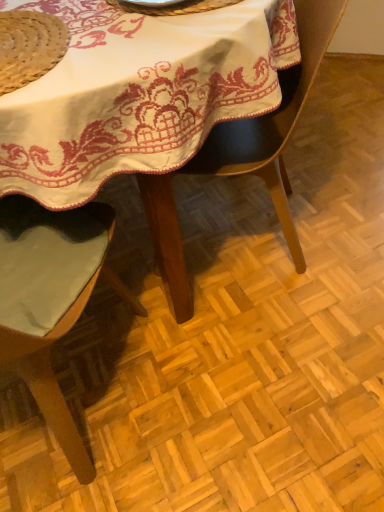
What is the approximate height of metallic silver plate at upper center?

2.01 centimeters.

Measure the distance between black leather chair at center, the first chair viewed from the right, and camera.

The distance of black leather chair at center, the first chair viewed from the right, from camera is 80.70 centimeters.

The width and height of the screenshot is (384, 512). I want to click on natural straw hat at upper left, so click(x=29, y=47).

From the image's perspective, is green fabric chair at left, which appears as the 1th chair when viewed from the left, above or below black leather chair at center, the first chair viewed from the right?

green fabric chair at left, which appears as the 1th chair when viewed from the left, is situated lower than black leather chair at center, the first chair viewed from the right, in the image.

Considering the points (11, 360) and (316, 56), which point is in front, point (11, 360) or point (316, 56)?

The point (11, 360) is more forward.

From a real-world perspective, is green fabric chair at left, which appears as the 1th chair when viewed from the left, positioned over black leather chair at center, the second chair in the left-to-right sequence, based on gravity?

No, from a real-world perspective, green fabric chair at left, which appears as the 1th chair when viewed from the left, is not on top of black leather chair at center, the second chair in the left-to-right sequence.

Which object is wider, natural straw hat at upper left or metallic silver plate at upper center?

metallic silver plate at upper center.

Considering the positions of points (15, 76) and (124, 6), is point (15, 76) closer to camera compared to point (124, 6)?

Yes, point (15, 76) is in front of point (124, 6).

Between natural straw hat at upper left and metallic silver plate at upper center, which one has smaller size?

natural straw hat at upper left is smaller.

Looking at this image, considering the positions of objects natural straw hat at upper left and metallic silver plate at upper center in the image provided, who is more to the left, natural straw hat at upper left or metallic silver plate at upper center?

natural straw hat at upper left.

Considering the points (229, 5) and (53, 51), which point is behind, point (229, 5) or point (53, 51)?

The point (229, 5) is more distant.

Is metallic silver plate at upper center touching natural straw hat at upper left?

They are not placed beside each other.

In the image, is metallic silver plate at upper center on the left side or the right side of natural straw hat at upper left?

metallic silver plate at upper center is positioned on natural straw hat at upper left's right side.

Considering the sizes of objects metallic silver plate at upper center and natural straw hat at upper left in the image provided, who is smaller, metallic silver plate at upper center or natural straw hat at upper left?

natural straw hat at upper left is smaller.

Considering the relative sizes of black leather chair at center, the second chair in the left-to-right sequence, and natural straw hat at upper left in the image provided, is black leather chair at center, the second chair in the left-to-right sequence, smaller than natural straw hat at upper left?

Actually, black leather chair at center, the second chair in the left-to-right sequence, might be larger than natural straw hat at upper left.

From a real-world perspective, is black leather chair at center, the second chair in the left-to-right sequence, positioned under natural straw hat at upper left based on gravity?

Yes.

Measure the distance from black leather chair at center, the second chair in the left-to-right sequence, to natural straw hat at upper left.

A distance of 19.45 inches exists between black leather chair at center, the second chair in the left-to-right sequence, and natural straw hat at upper left.

Is green fabric chair at left, which is the second chair in right-to-left order, inside the boundaries of metallic silver plate at upper center, or outside?

green fabric chair at left, which is the second chair in right-to-left order, is located beyond the bounds of metallic silver plate at upper center.

In the image, is green fabric chair at left, which appears as the 1th chair when viewed from the left, on the left side or the right side of metallic silver plate at upper center?

green fabric chair at left, which appears as the 1th chair when viewed from the left, is positioned on metallic silver plate at upper center's left side.

Based on the photo, looking at the image, does green fabric chair at left, which appears as the 1th chair when viewed from the left, seem bigger or smaller compared to metallic silver plate at upper center?

Considering their sizes, green fabric chair at left, which appears as the 1th chair when viewed from the left, takes up more space than metallic silver plate at upper center.

In the image, there is a green fabric chair at left, which is the second chair in right-to-left order. Where is `tableware above it (from the image's perspective)`? The height and width of the screenshot is (512, 384). tableware above it (from the image's perspective) is located at coordinates (173, 7).

Is natural straw hat at upper left at the left side of white embroidered tablecloth at center?

Indeed, natural straw hat at upper left is positioned on the left side of white embroidered tablecloth at center.

Could you tell me if natural straw hat at upper left is facing white embroidered tablecloth at center?

Yes, natural straw hat at upper left is facing white embroidered tablecloth at center.

Is point (56, 29) farther from viewer compared to point (170, 59)?

Yes, it is behind point (170, 59).

Between natural straw hat at upper left and white embroidered tablecloth at center, which one has larger width?

Wider between the two is white embroidered tablecloth at center.

Considering the relative sizes of natural straw hat at upper left and green fabric chair at left, which appears as the 1th chair when viewed from the left, in the image provided, is natural straw hat at upper left bigger than green fabric chair at left, which appears as the 1th chair when viewed from the left,?

No, natural straw hat at upper left is not bigger than green fabric chair at left, which appears as the 1th chair when viewed from the left.

Are natural straw hat at upper left and green fabric chair at left, which is the second chair in right-to-left order, located far from each other?

No, natural straw hat at upper left is in close proximity to green fabric chair at left, which is the second chair in right-to-left order.

Does natural straw hat at upper left have a greater height compared to green fabric chair at left, which appears as the 1th chair when viewed from the left?

No, natural straw hat at upper left is not taller than green fabric chair at left, which appears as the 1th chair when viewed from the left.

Does point (4, 35) appear closer or farther from the camera than point (58, 246)?

Point (4, 35).

I want to click on chair behind the green fabric chair at left, which appears as the 1th chair when viewed from the left, so click(x=274, y=121).

The width and height of the screenshot is (384, 512). In order to click on straw hat that is in front of the metallic silver plate at upper center in this screenshot , I will do `click(29, 47)`.

Which object lies nearer to the anchor point natural straw hat at upper left, green fabric chair at left, which is the second chair in right-to-left order, or white embroidered tablecloth at center?

white embroidered tablecloth at center lies closer to natural straw hat at upper left than the other object.

When comparing their distances from black leather chair at center, the first chair viewed from the right, does metallic silver plate at upper center or natural straw hat at upper left seem further?

natural straw hat at upper left.

When comparing their distances from black leather chair at center, the second chair in the left-to-right sequence, does green fabric chair at left, which appears as the 1th chair when viewed from the left, or white embroidered tablecloth at center seem closer?

Among the two, white embroidered tablecloth at center is located nearer to black leather chair at center, the second chair in the left-to-right sequence.

Considering their positions, is natural straw hat at upper left positioned closer to black leather chair at center, the second chair in the left-to-right sequence, than metallic silver plate at upper center?

Among the two, metallic silver plate at upper center is located nearer to black leather chair at center, the second chair in the left-to-right sequence.

Estimate the real-world distances between objects in this image. Which object is closer to green fabric chair at left, which is the second chair in right-to-left order, black leather chair at center, the second chair in the left-to-right sequence, or metallic silver plate at upper center?

The object closer to green fabric chair at left, which is the second chair in right-to-left order, is black leather chair at center, the second chair in the left-to-right sequence.

Estimate the real-world distances between objects in this image. Which object is closer to white embroidered tablecloth at center, natural straw hat at upper left or metallic silver plate at upper center?

Among the two, natural straw hat at upper left is located nearer to white embroidered tablecloth at center.

Looking at this image, looking at the image, which one is located closer to metallic silver plate at upper center, natural straw hat at upper left or green fabric chair at left, which appears as the 1th chair when viewed from the left?

natural straw hat at upper left.

From the image, which object appears to be farther from green fabric chair at left, which is the second chair in right-to-left order, metallic silver plate at upper center or natural straw hat at upper left?

metallic silver plate at upper center is positioned further to the anchor green fabric chair at left, which is the second chair in right-to-left order.

Where is `chair between metallic silver plate at upper center and green fabric chair at left, which is the second chair in right-to-left order, vertically`? The width and height of the screenshot is (384, 512). chair between metallic silver plate at upper center and green fabric chair at left, which is the second chair in right-to-left order, vertically is located at coordinates (274, 121).

Identify the location of table between metallic silver plate at upper center and green fabric chair at left, which appears as the 1th chair when viewed from the left, from top to bottom. Image resolution: width=384 pixels, height=512 pixels. (138, 93).

Locate an element on the screen. This screenshot has width=384, height=512. straw hat between white embroidered tablecloth at center and green fabric chair at left, which is the second chair in right-to-left order, from top to bottom is located at coordinates (29, 47).

The image size is (384, 512). I want to click on straw hat situated between green fabric chair at left, which appears as the 1th chair when viewed from the left, and black leather chair at center, the first chair viewed from the right, from left to right, so click(29, 47).